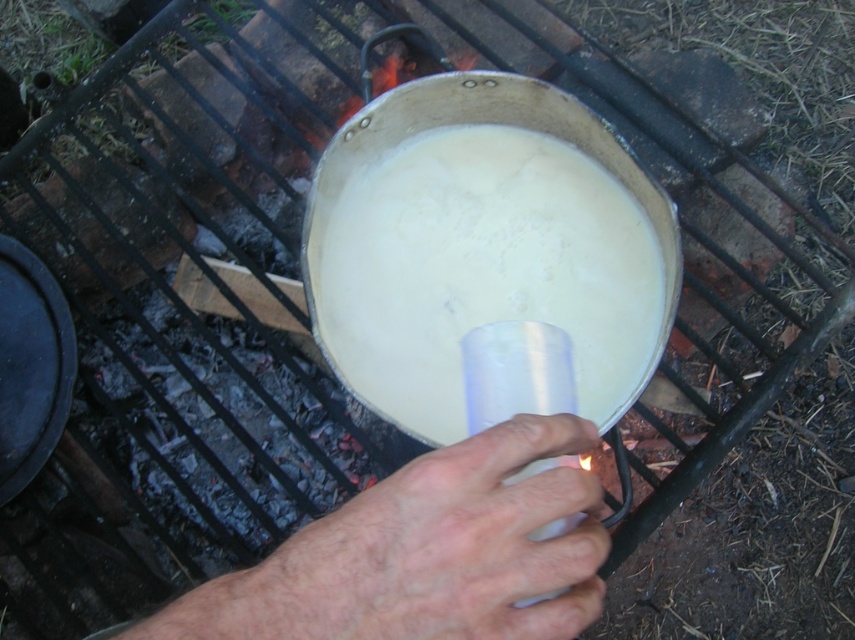
Question: Can you confirm if white matte liquid at center is positioned to the right of dry skin at center?

Choices:
 (A) no
 (B) yes

Answer: (B)

Question: Which point appears farthest from the camera in this image?

Choices:
 (A) (429, 269)
 (B) (378, 596)

Answer: (A)

Question: Where is white matte liquid at center located in relation to dry skin at center in the image?

Choices:
 (A) above
 (B) below

Answer: (A)

Question: Does white matte liquid at center have a larger size compared to dry skin at center?

Choices:
 (A) no
 (B) yes

Answer: (B)